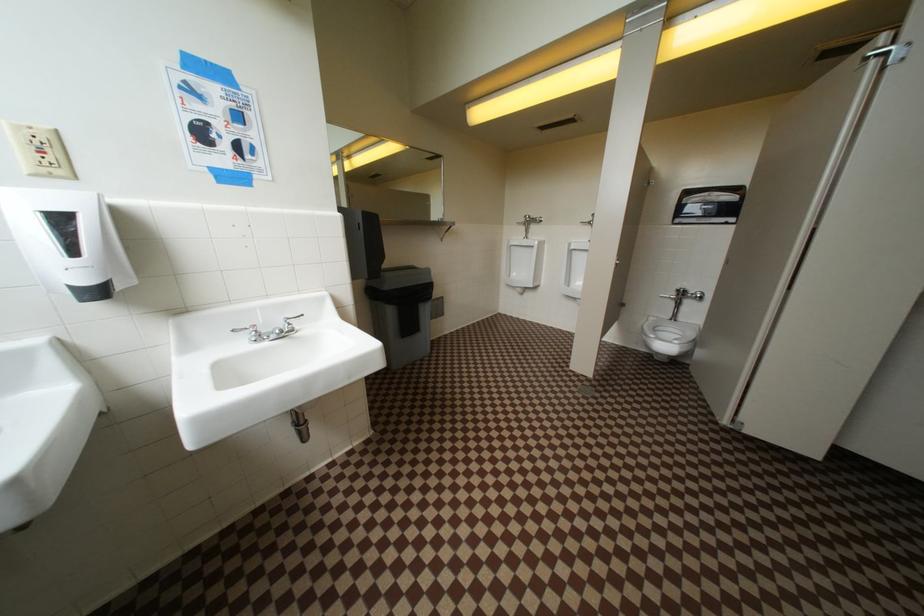
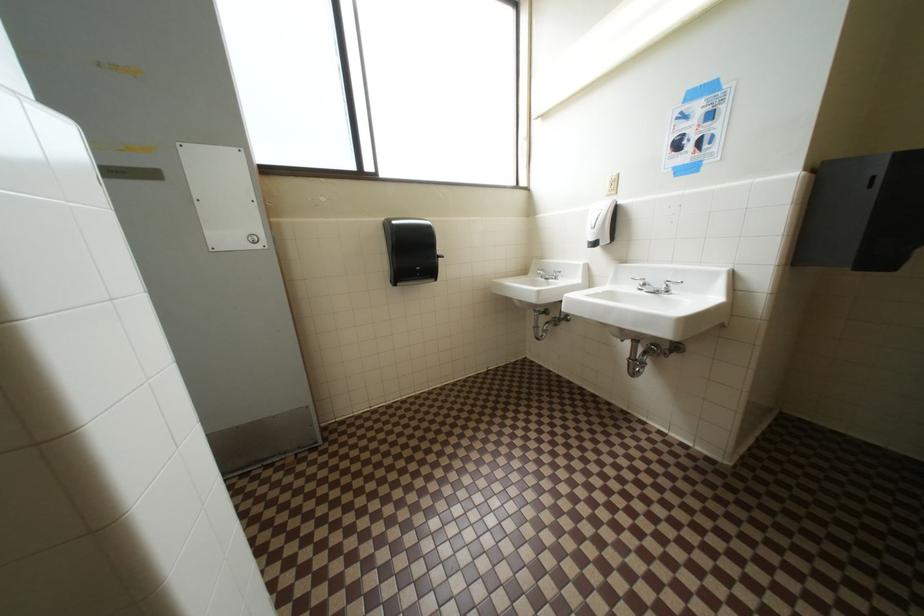
How did the camera likely rotate?

The camera's rotation is toward left-down.